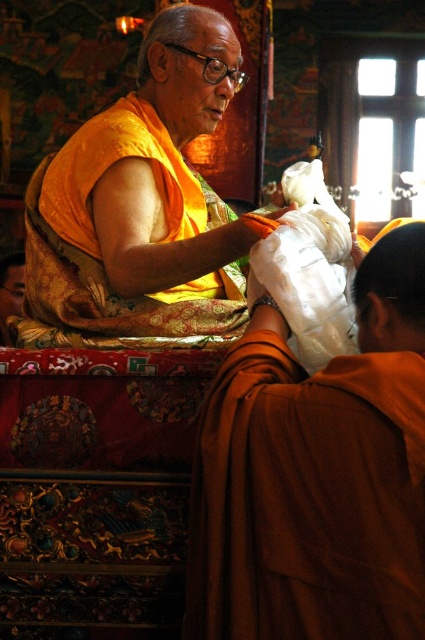
Is orange silk robe at center thinner than matte orange robe at center?

Yes.

Does point (308, 557) come behind point (118, 212)?

That is False.

Locate an element on the screen. This screenshot has height=640, width=425. orange silk robe at center is located at coordinates (317, 474).